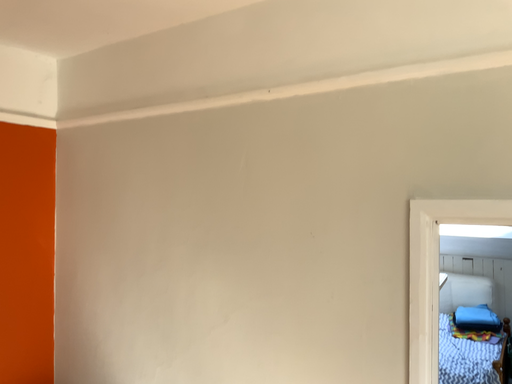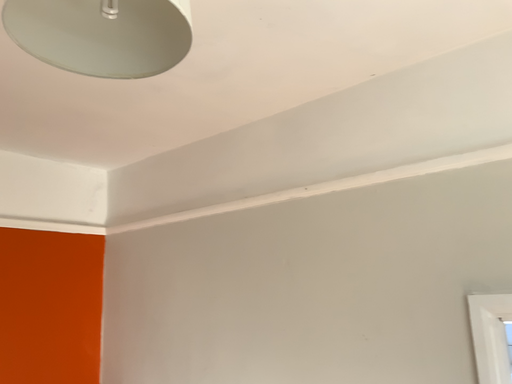
Question: How did the camera likely rotate when shooting the video?

Choices:
 (A) rotated upward
 (B) rotated downward

Answer: (A)